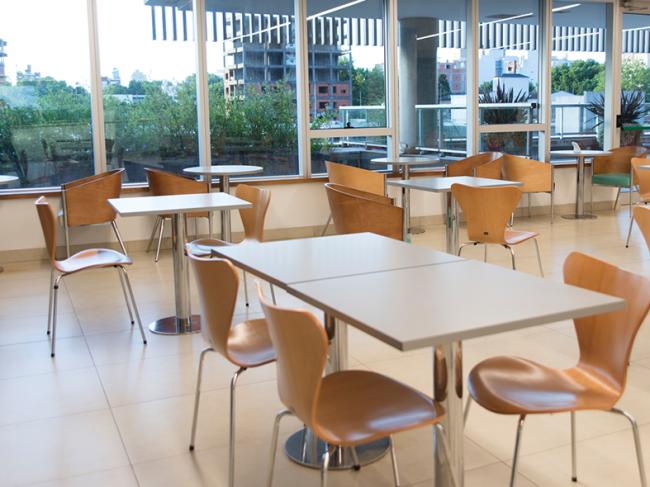
You are a GUI agent. You are given a task and a screenshot of the screen. Output one action in this format:
    pyautogui.click(x=<x>, y=<y>)
    Task: Click on the window frames
    
    Given the screenshot: What is the action you would take?
    pyautogui.click(x=96, y=101), pyautogui.click(x=203, y=100), pyautogui.click(x=302, y=104), pyautogui.click(x=356, y=132), pyautogui.click(x=390, y=84), pyautogui.click(x=473, y=85), pyautogui.click(x=509, y=127), pyautogui.click(x=546, y=81), pyautogui.click(x=615, y=71)